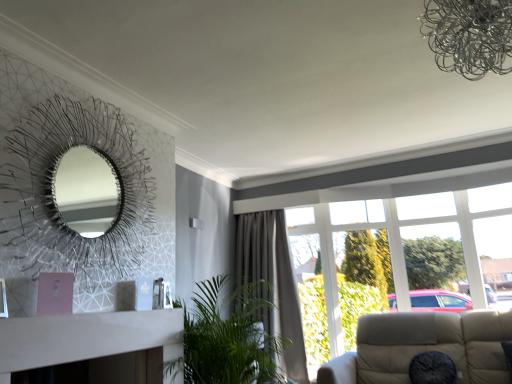
Question: Does green leafy plant at center appear on the right side of metallic silver fireplace at left?

Choices:
 (A) no
 (B) yes

Answer: (B)

Question: From the image's perspective, is green leafy plant at center on metallic silver fireplace at left?

Choices:
 (A) no
 (B) yes

Answer: (A)

Question: Is green leafy plant at center bigger than metallic silver fireplace at left?

Choices:
 (A) yes
 (B) no

Answer: (A)

Question: Is green leafy plant at center to the left of metallic silver fireplace at left from the viewer's perspective?

Choices:
 (A) no
 (B) yes

Answer: (A)

Question: Is green leafy plant at center surrounding metallic silver fireplace at left?

Choices:
 (A) yes
 (B) no

Answer: (B)

Question: Considering the positions of black fabric cushion at lower right and transparent glass window at right in the image, is black fabric cushion at lower right taller or shorter than transparent glass window at right?

Choices:
 (A) short
 (B) tall

Answer: (A)

Question: Does point (422, 352) appear closer or farther from the camera than point (371, 196)?

Choices:
 (A) farther
 (B) closer

Answer: (B)

Question: Considering the positions of black fabric cushion at lower right and transparent glass window at right in the image, is black fabric cushion at lower right wider or thinner than transparent glass window at right?

Choices:
 (A) thin
 (B) wide

Answer: (A)

Question: In terms of size, does black fabric cushion at lower right appear bigger or smaller than transparent glass window at right?

Choices:
 (A) big
 (B) small

Answer: (B)

Question: From a real-world perspective, is gray fabric curtain at center above or below green leafy plant at center?

Choices:
 (A) above
 (B) below

Answer: (A)

Question: From the image's perspective, is gray fabric curtain at center located above or below green leafy plant at center?

Choices:
 (A) below
 (B) above

Answer: (A)

Question: Is gray fabric curtain at center taller or shorter than green leafy plant at center?

Choices:
 (A) tall
 (B) short

Answer: (A)

Question: Is point (244, 281) positioned closer to the camera than point (273, 352)?

Choices:
 (A) closer
 (B) farther

Answer: (B)

Question: From their relative heights in the image, would you say metallic silver fireplace at left is taller or shorter than green leafy plant at center?

Choices:
 (A) tall
 (B) short

Answer: (A)

Question: From the image's perspective, is metallic silver fireplace at left positioned above or below green leafy plant at center?

Choices:
 (A) below
 (B) above

Answer: (B)